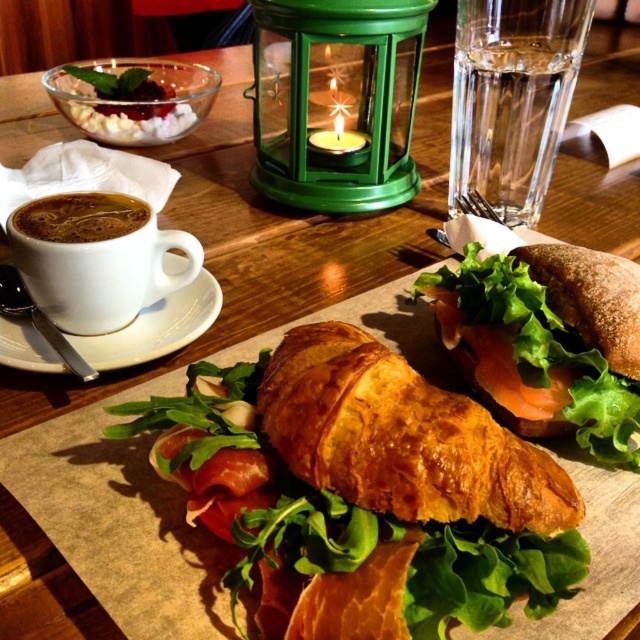
Question: Can you confirm if green leafy salad at center is positioned to the right of brown matte cup at upper left?

Choices:
 (A) yes
 (B) no

Answer: (A)

Question: Which object appears closest to the camera in this image?

Choices:
 (A) brown crusty sandwich at center
 (B) green leafy salad at center
 (C) clear glass water at upper right
 (D) white ceramic cup at upper left

Answer: (B)

Question: Which is farther from the clear glass water at upper right?

Choices:
 (A) white ceramic cup at upper left
 (B) brown matte cup of coffee at upper left
 (C) golden brown flaky croissant at center
 (D) brown matte cup at upper left

Answer: (B)

Question: Does green leafy salad at center appear on the right side of brown crusty sandwich at center?

Choices:
 (A) yes
 (B) no

Answer: (B)

Question: Does white ceramic cup at upper left appear on the right side of brown matte cup of coffee at upper left?

Choices:
 (A) yes
 (B) no

Answer: (A)

Question: Among these points, which one is farthest from the camera?

Choices:
 (A) (474, 604)
 (B) (221, 304)
 (C) (312, 445)
 (D) (52, 221)

Answer: (B)